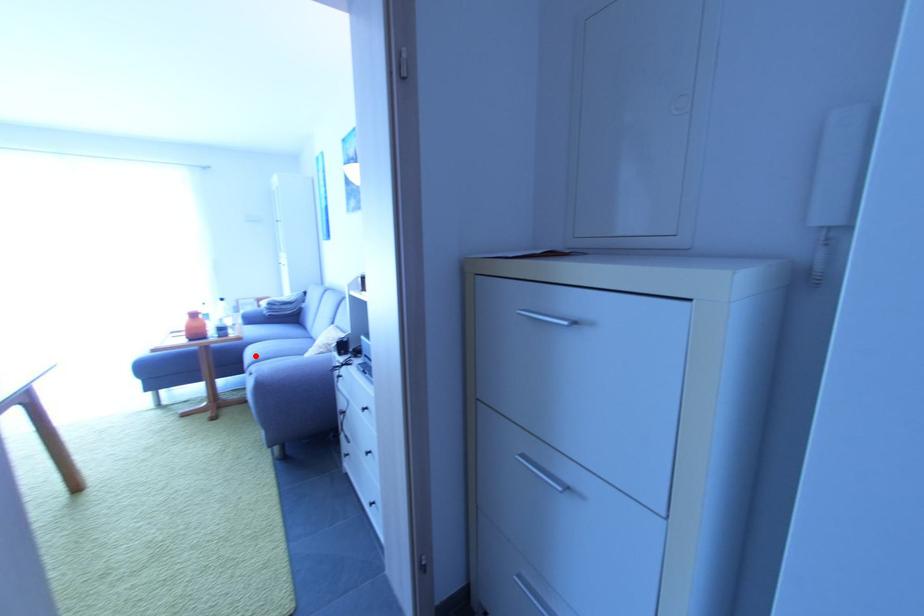
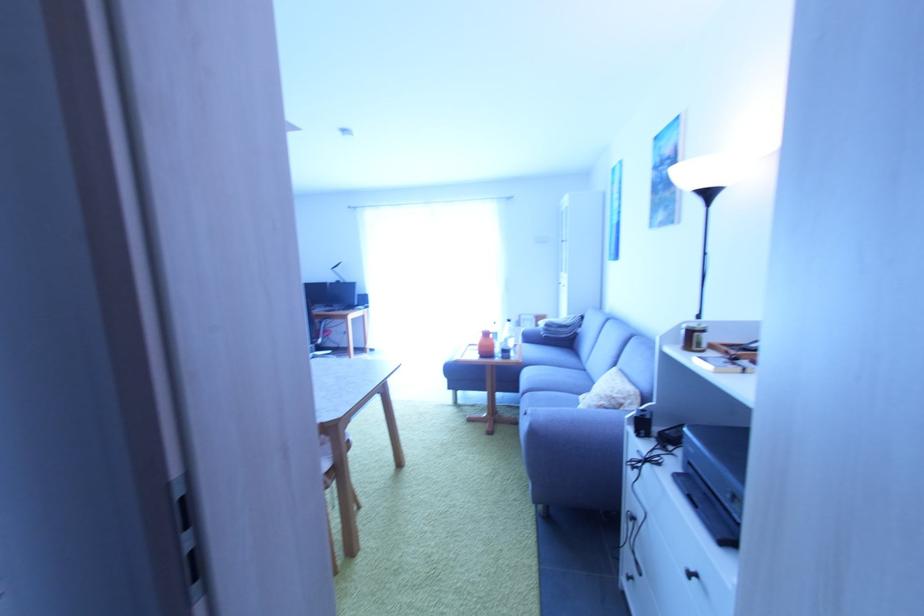
Question: I am providing you with two images of the same scene from different viewpoints. Given a red point in image1, look at the same physical point in image2. Is it:

Choices:
 (A) Closer to the viewpoint
 (B) Farther from the viewpoint

Answer: (B)